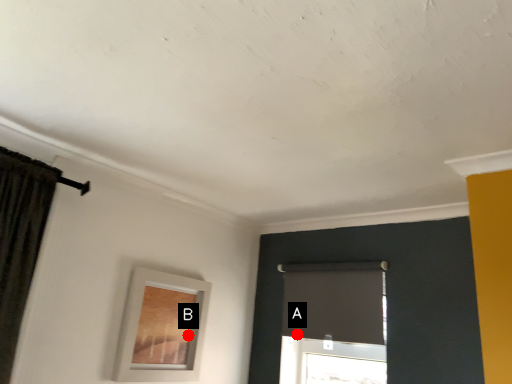
Question: Two points are circled on the image, labeled by A and B beside each circle. Which point appears closest to the camera in this image?

Choices:
 (A) A is closer
 (B) B is closer

Answer: (B)